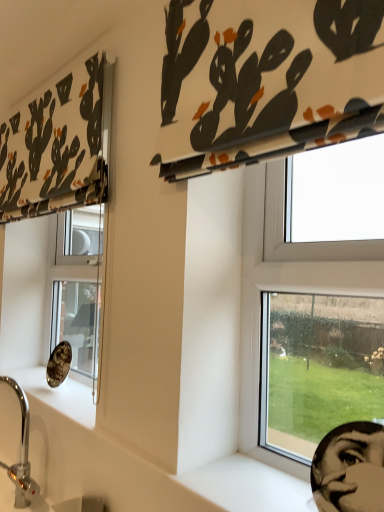
Locate an element on the screen. free point above white smooth window sill at lower right (from a real-world perspective) is located at coordinates (263, 478).